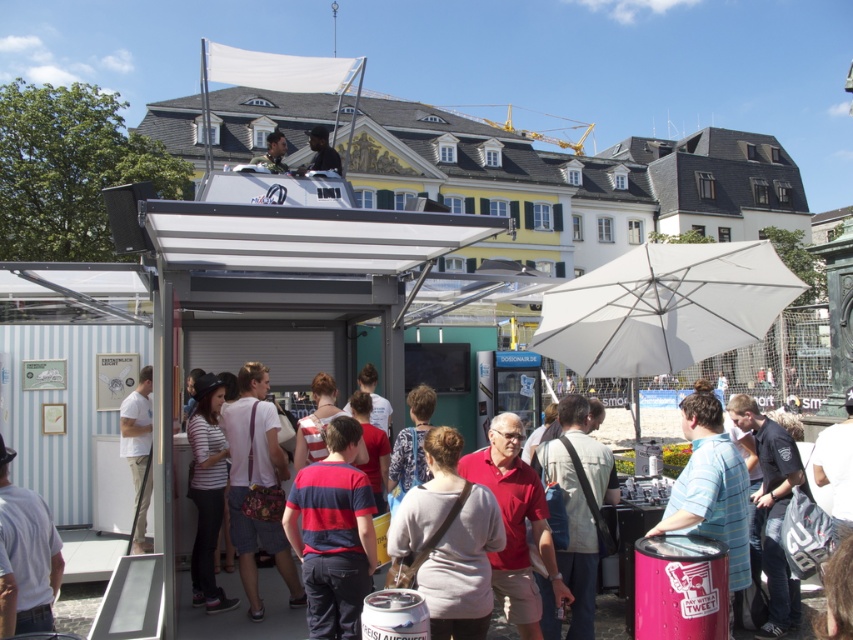
You are standing at the event and want to take a photo of the white matte umbrella at center. If your camera has a maximum focus range of 20 feet, will you be able to capture the umbrella clearly?

The white matte umbrella at center is 21.49 feet away from the viewer, which exceeds the camera maximum focus range of 20 feet. Therefore, the camera cannot focus on the umbrella clearly.